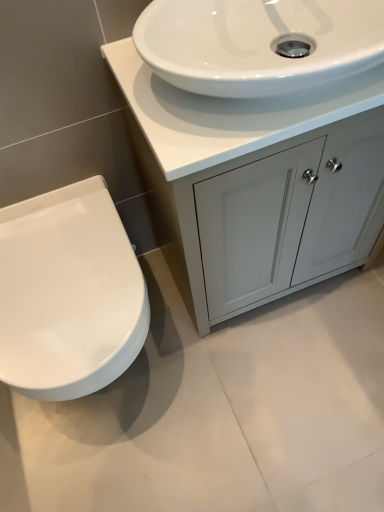
Where is `empty space that is ontop of white glossy toilet at left (from a real-world perspective)`? Image resolution: width=384 pixels, height=512 pixels. empty space that is ontop of white glossy toilet at left (from a real-world perspective) is located at coordinates (56, 274).